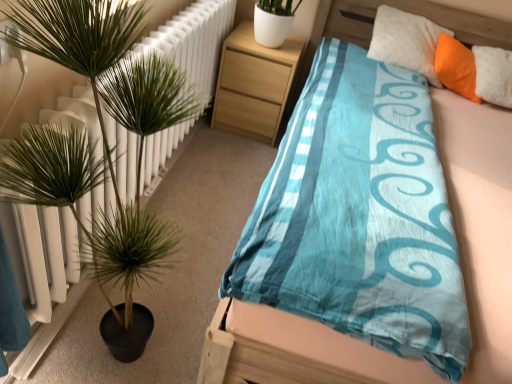
The width and height of the screenshot is (512, 384). Describe the element at coordinates (74, 37) in the screenshot. I see `green leafy plant at left` at that location.

Where is `light wood/texture nightstand at upper center`? light wood/texture nightstand at upper center is located at coordinates (254, 84).

Between green leafy plant at left and blue satin bed at center, which one has larger width?

blue satin bed at center is wider.

Which is farther, (51,59) or (493,182)?

Point (493,182)

From the picture: Is green leafy plant at left facing towards blue satin bed at center?

Yes, green leafy plant at left is facing blue satin bed at center.

From the image's perspective, which is above, green leafy plant at left or blue satin bed at center?

A: From the image's view, blue satin bed at center is above.

What's the angular difference between green leafy plant at left and light wood/texture nightstand at upper center's facing directions?

green leafy plant at left and light wood/texture nightstand at upper center are facing 95.8 degrees away from each other.

Considering the relative positions of green leafy plant at left and light wood/texture nightstand at upper center in the image provided, is green leafy plant at left to the right of light wood/texture nightstand at upper center from the viewer's perspective?

In fact, green leafy plant at left is to the left of light wood/texture nightstand at upper center.

From the image's perspective, is green leafy plant at left over light wood/texture nightstand at upper center?

No, from the image's perspective, green leafy plant at left is not above light wood/texture nightstand at upper center.

How much distance is there between green leafy plant at left and light wood/texture nightstand at upper center?

green leafy plant at left is 3.40 feet from light wood/texture nightstand at upper center.

Between blue satin bed at center and light wood/texture nightstand at upper center, which one has smaller width?

With smaller width is light wood/texture nightstand at upper center.

You are a GUI agent. You are given a task and a screenshot of the screen. Output one action in this format:
    pyautogui.click(x=<x>, y=<y>)
    Task: Click on the bed that is below the light wood/texture nightstand at upper center (from the image's perspective)
    
    Given the screenshot: What is the action you would take?
    pyautogui.click(x=481, y=224)

Is blue satin bed at center taller than green leafy plant at left?

Incorrect, the height of blue satin bed at center is not larger of that of green leafy plant at left.

From the image's perspective, is blue satin bed at center positioned above or below green leafy plant at left?

Clearly, from the image's perspective, blue satin bed at center is above green leafy plant at left.

Which of these two, blue satin bed at center or green leafy plant at left, is bigger?

With larger size is blue satin bed at center.

From a real-world perspective, relative to blue satin bed at center, is light wood/texture nightstand at upper center vertically above or below?

In terms of real-world spatial position, light wood/texture nightstand at upper center is below blue satin bed at center.

Does light wood/texture nightstand at upper center have a smaller size compared to blue satin bed at center?

Yes.

Is light wood/texture nightstand at upper center in front of or behind blue satin bed at center in the image?

light wood/texture nightstand at upper center is positioned farther from the viewer than blue satin bed at center.

Which is correct: light wood/texture nightstand at upper center is inside blue satin bed at center, or outside of it?

light wood/texture nightstand at upper center is not inside blue satin bed at center, it's outside.

Which is nearer, (x=229, y=91) or (x=213, y=46)?

Point (x=229, y=91) appears to be farther away from the viewer than point (x=213, y=46).

Where is `nightstand that appears above the green leafy plant at left (from the image's perspective)`? The image size is (512, 384). nightstand that appears above the green leafy plant at left (from the image's perspective) is located at coordinates (254, 84).

In the scene shown: From a real-world perspective, who is located lower, light wood/texture nightstand at upper center or green leafy plant at left?

light wood/texture nightstand at upper center, from a real-world perspective.

Where is `houseplant in front of the blue satin bed at center`? The height and width of the screenshot is (384, 512). houseplant in front of the blue satin bed at center is located at coordinates (74, 37).

Where is `nightstand that is above the green leafy plant at left (from the image's perspective)`? nightstand that is above the green leafy plant at left (from the image's perspective) is located at coordinates (254, 84).

Considering their positions, is blue satin bed at center positioned closer to light wood/texture nightstand at upper center than green leafy plant at left?

The object closer to light wood/texture nightstand at upper center is green leafy plant at left.

Looking at the image, which one is located further to green leafy plant at left, blue satin bed at center or light wood/texture nightstand at upper center?

light wood/texture nightstand at upper center lies further to green leafy plant at left than the other object.

From the image, which object appears to be farther from blue satin bed at center, green leafy plant at left or light wood/texture nightstand at upper center?

light wood/texture nightstand at upper center.

From the image, which object appears to be farther from green leafy plant at left, light wood/texture nightstand at upper center or blue satin bed at center?

The object further to green leafy plant at left is light wood/texture nightstand at upper center.

When comparing their distances from blue satin bed at center, does light wood/texture nightstand at upper center or green leafy plant at left seem closer?

Among the two, green leafy plant at left is located nearer to blue satin bed at center.

Which object lies nearer to the anchor point light wood/texture nightstand at upper center, green leafy plant at left or blue satin bed at center?

green leafy plant at left.

At what (x,y) coordinates should I click in order to perform the action: click on bed located between green leafy plant at left and light wood/texture nightstand at upper center in the depth direction. Please return your answer as a coordinate pair (x, y). Looking at the image, I should click on (481, 224).